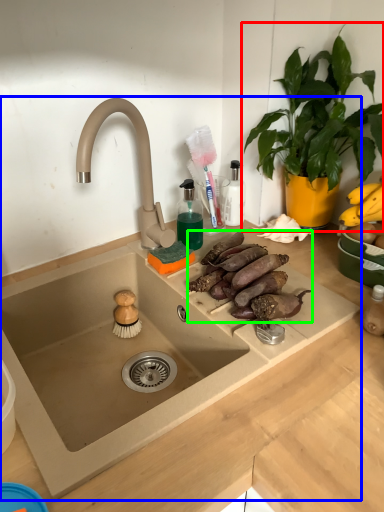
Question: Which object is positioned closest to houseplant (highlighted by a red box)? Select from sink (highlighted by a blue box) and food (highlighted by a green box).

Choices:
 (A) sink
 (B) food

Answer: (B)